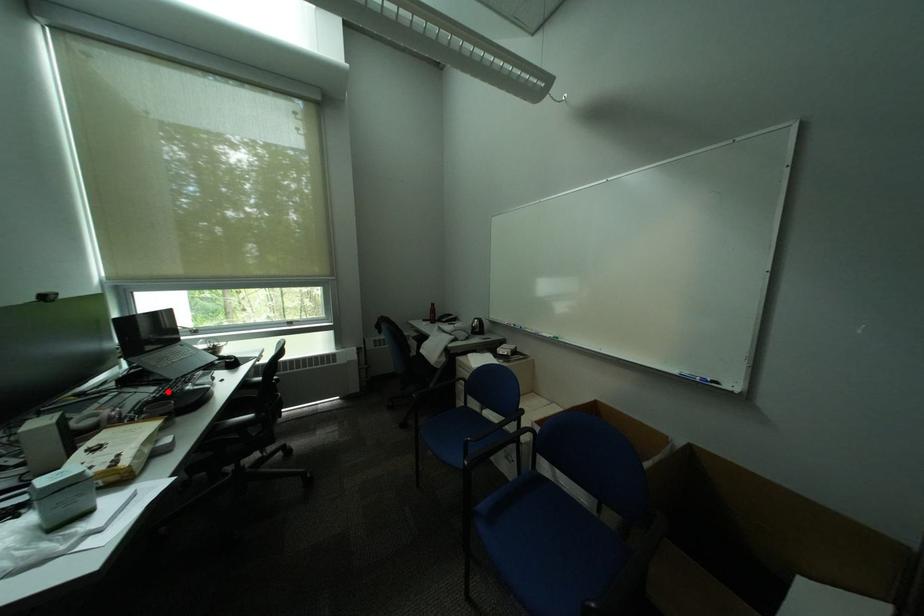
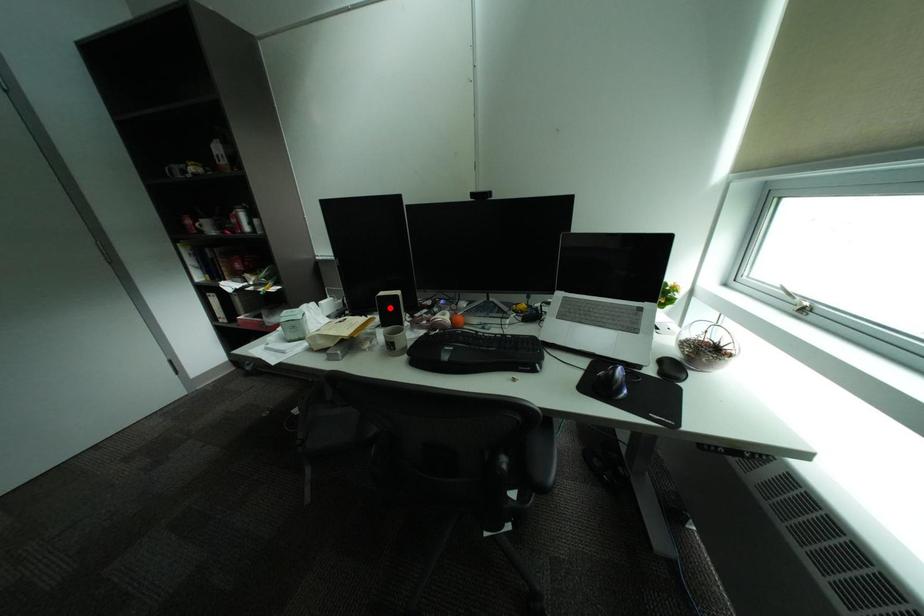
I am providing you with two images of the same scene from different viewpoints. A red point is marked on the first image and another point is marked on the second image. Is the marked point in image1 the same physical position as the marked point in image2?

No